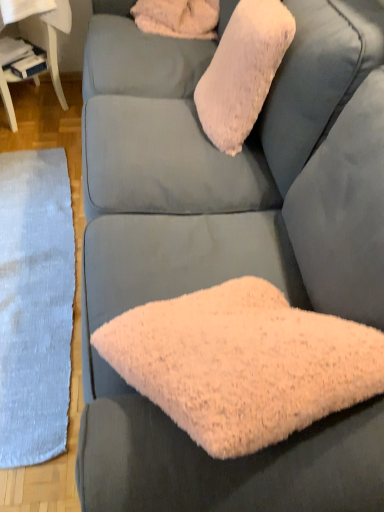
Question: Considering the relative sizes of fluffy pink pillow at upper center and white glossy table at lower left in the image provided, is fluffy pink pillow at upper center taller than white glossy table at lower left?

Choices:
 (A) yes
 (B) no

Answer: (B)

Question: Can you confirm if fluffy pink pillow at upper center is bigger than white glossy table at lower left?

Choices:
 (A) no
 (B) yes

Answer: (A)

Question: Considering the relative sizes of fluffy pink pillow at upper center and white glossy table at lower left in the image provided, is fluffy pink pillow at upper center smaller than white glossy table at lower left?

Choices:
 (A) no
 (B) yes

Answer: (B)

Question: Is white glossy table at lower left located within fluffy pink pillow at upper center?

Choices:
 (A) no
 (B) yes

Answer: (A)

Question: Considering the relative sizes of fluffy pink pillow at upper center and white glossy table at lower left in the image provided, is fluffy pink pillow at upper center thinner than white glossy table at lower left?

Choices:
 (A) no
 (B) yes

Answer: (B)

Question: Considering the positions of point (206, 32) and point (29, 10), is point (206, 32) closer or farther from the camera than point (29, 10)?

Choices:
 (A) farther
 (B) closer

Answer: (A)

Question: From a real-world perspective, is white fluffy pillow at upper center physically located above or below white glossy table at lower left?

Choices:
 (A) below
 (B) above

Answer: (B)

Question: Based on their sizes in the image, would you say white fluffy pillow at upper center is bigger or smaller than white glossy table at lower left?

Choices:
 (A) small
 (B) big

Answer: (A)

Question: From the image's perspective, relative to white glossy table at lower left, is white fluffy pillow at upper center above or below?

Choices:
 (A) above
 (B) below

Answer: (A)

Question: Visually, is fluffy pink pillow at upper center positioned to the left or to the right of white glossy table at lower left?

Choices:
 (A) right
 (B) left

Answer: (A)

Question: Is fluffy pink pillow at upper center bigger or smaller than white glossy table at lower left?

Choices:
 (A) big
 (B) small

Answer: (B)

Question: From a real-world perspective, relative to white glossy table at lower left, is fluffy pink pillow at upper center vertically above or below?

Choices:
 (A) above
 (B) below

Answer: (A)

Question: Would you say fluffy pink pillow at upper center is inside or outside white glossy table at lower left?

Choices:
 (A) outside
 (B) inside

Answer: (A)

Question: Considering the positions of white glossy table at lower left and white fluffy pillow at upper center in the image, is white glossy table at lower left taller or shorter than white fluffy pillow at upper center?

Choices:
 (A) tall
 (B) short

Answer: (A)

Question: Considering the positions of white glossy table at lower left and white fluffy pillow at upper center in the image, is white glossy table at lower left wider or thinner than white fluffy pillow at upper center?

Choices:
 (A) wide
 (B) thin

Answer: (A)